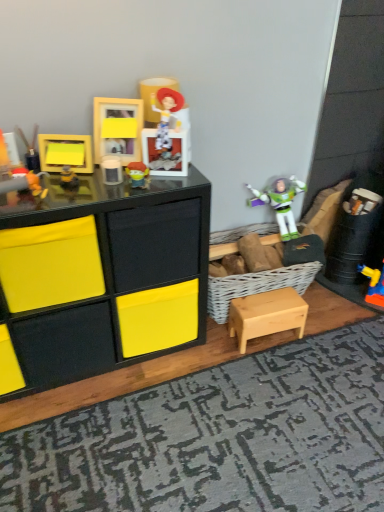
Question: From a real-world perspective, is matte yellow frame at upper center, which is counted as the fifth toy, starting from the left, over matte black frame at upper left, the first toy when ordered from left to right?

Choices:
 (A) no
 (B) yes

Answer: (B)

Question: Considering the relative sizes of matte yellow frame at upper center, which appears as the second toy when viewed from the right, and matte black frame at upper left, the 6th toy in the right-to-left sequence, in the image provided, is matte yellow frame at upper center, which appears as the second toy when viewed from the right, wider than matte black frame at upper left, the 6th toy in the right-to-left sequence,?

Choices:
 (A) yes
 (B) no

Answer: (B)

Question: Is matte yellow frame at upper center, which is counted as the fifth toy, starting from the left, turned away from matte black frame at upper left, the 6th toy in the right-to-left sequence?

Choices:
 (A) yes
 (B) no

Answer: (B)

Question: Would you say matte yellow frame at upper center, which appears as the second toy when viewed from the right, is outside matte black frame at upper left, the first toy when ordered from left to right?

Choices:
 (A) no
 (B) yes

Answer: (B)

Question: Would you consider matte yellow frame at upper center, which is counted as the fifth toy, starting from the left, to be distant from matte black frame at upper left, the 6th toy in the right-to-left sequence?

Choices:
 (A) no
 (B) yes

Answer: (A)

Question: In terms of size, does matte black frame at upper left, the first toy when ordered from left to right, appear bigger or smaller than matte black chest of drawers at left?

Choices:
 (A) big
 (B) small

Answer: (B)

Question: From a real-world perspective, is matte black frame at upper left, the first toy when ordered from left to right, above or below matte black chest of drawers at left?

Choices:
 (A) above
 (B) below

Answer: (A)

Question: Is matte black frame at upper left, the first toy when ordered from left to right, to the left or to the right of matte black chest of drawers at left in the image?

Choices:
 (A) right
 (B) left

Answer: (B)

Question: From the image's perspective, relative to matte black chest of drawers at left, is matte black frame at upper left, the first toy when ordered from left to right, above or below?

Choices:
 (A) below
 (B) above

Answer: (B)

Question: Considering the positions of matte yellow frame at upper left, which appears as the fourth toy when viewed from the left, and matte black chest of drawers at left in the image, is matte yellow frame at upper left, which appears as the fourth toy when viewed from the left, wider or thinner than matte black chest of drawers at left?

Choices:
 (A) wide
 (B) thin

Answer: (B)

Question: In terms of size, does matte yellow frame at upper left, which ranks as the 3th toy in right-to-left order, appear bigger or smaller than matte black chest of drawers at left?

Choices:
 (A) small
 (B) big

Answer: (A)

Question: In terms of height, does matte yellow frame at upper left, which appears as the fourth toy when viewed from the left, look taller or shorter compared to matte black chest of drawers at left?

Choices:
 (A) tall
 (B) short

Answer: (B)

Question: Is point (71, 184) positioned closer to the camera than point (94, 320)?

Choices:
 (A) farther
 (B) closer

Answer: (B)

Question: From a real-world perspective, is matte black frame at upper left, the first toy when ordered from left to right, physically located above or below light wood table at lower right?

Choices:
 (A) above
 (B) below

Answer: (A)

Question: Is matte black frame at upper left, the 6th toy in the right-to-left sequence, inside or outside of light wood table at lower right?

Choices:
 (A) outside
 (B) inside

Answer: (A)